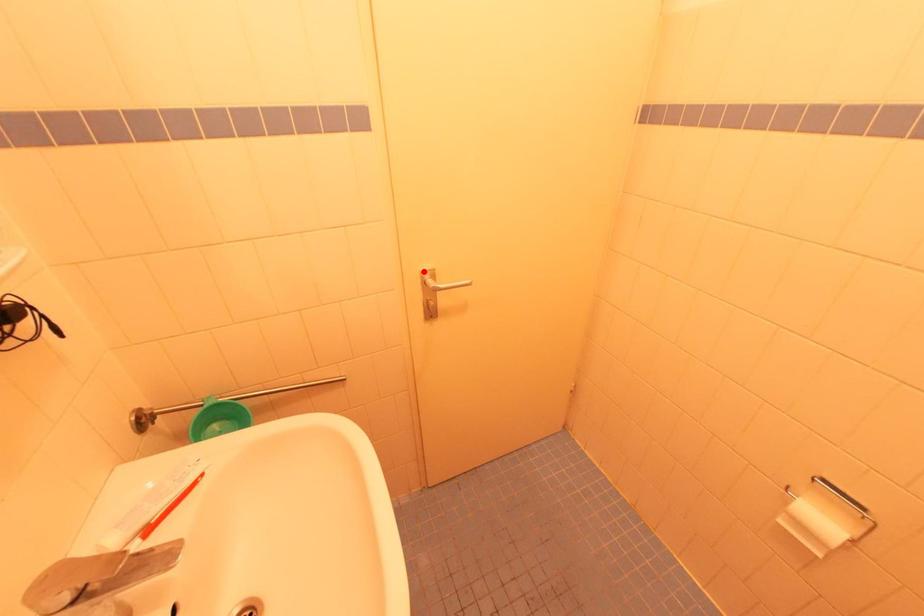
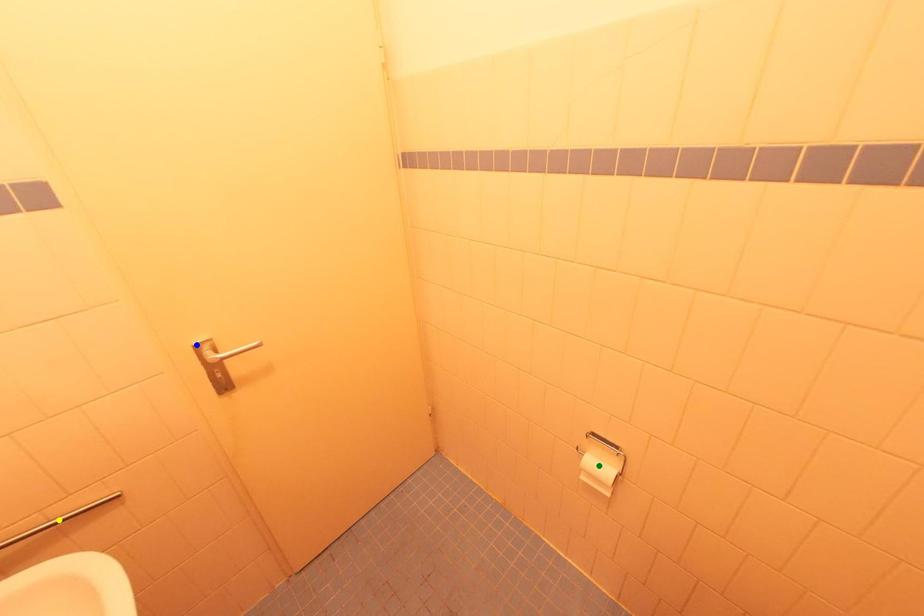
Question: I am providing you with two images of the same scene from different viewpoints. A red point is marked on the first image. You are given multiple points on the second image. In image 2, which mark is for the same physical point as the one in image 1?

Choices:
 (A) yellow point
 (B) blue point
 (C) green point

Answer: (B)